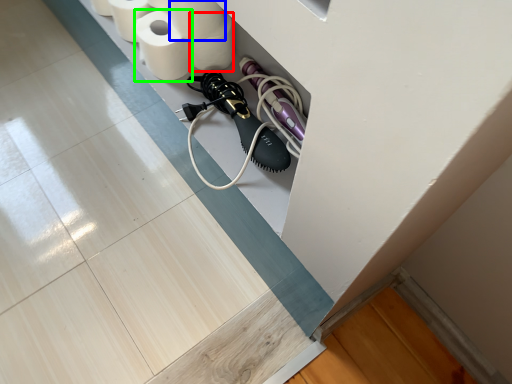
Question: Estimate the real-world distances between objects in this image. Which object is closer to toilet paper (highlighted by a red box), toilet paper (highlighted by a blue box) or toilet paper (highlighted by a green box)?

Choices:
 (A) toilet paper
 (B) toilet paper

Answer: (A)